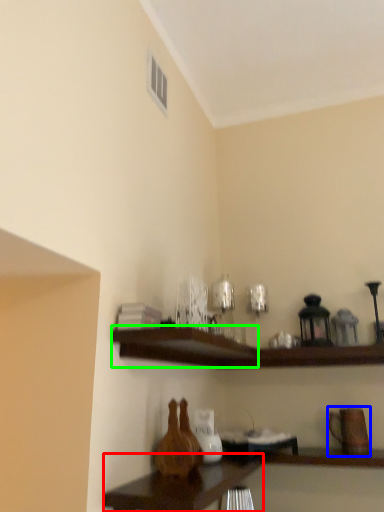
Question: Which is nearer to the table (highlighted by a red box)? pottery (highlighted by a blue box) or shelf (highlighted by a green box).

Choices:
 (A) pottery
 (B) shelf

Answer: (B)